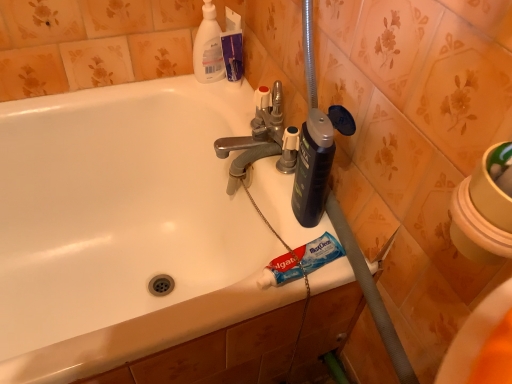
In order to face white glossy bathtub at center, should I rotate leftwards or rightwards?

To face it directly, rotate left by 16.493 degrees.

What do you see at coordinates (124, 226) in the screenshot?
I see `white glossy bathtub at center` at bounding box center [124, 226].

At what (x,y) coordinates should I click in order to perform the action: click on polished chrome faucet at center. Please return your answer as a coordinate pair (x, y). Looking at the image, I should click on (261, 138).

From the image's perspective, is blue matte toothpaste at lower center positioned above or below white plastic bottle at upper center?

blue matte toothpaste at lower center is situated lower than white plastic bottle at upper center in the image.

At what (x,y) coordinates should I click in order to perform the action: click on cleaning product located behind the blue matte toothpaste at lower center. Please return your answer as a coordinate pair (x, y). This screenshot has height=384, width=512. Looking at the image, I should click on (208, 47).

From a real-world perspective, who is located higher, blue matte toothpaste at lower center or white plastic bottle at upper center?

white plastic bottle at upper center.

Is blue matte toothpaste at lower center in front of white plastic bottle at upper center?

Yes, it is.

From the image's perspective, who appears lower, white glossy bathtub at center or white plastic bottle at upper center?

From the image's view, white glossy bathtub at center is below.

How many degrees apart are the facing directions of white glossy bathtub at center and white plastic bottle at upper center?

0.983 degrees separate the facing orientations of white glossy bathtub at center and white plastic bottle at upper center.

Is white glossy bathtub at center bigger than white plastic bottle at upper center?

Correct, white glossy bathtub at center is larger in size than white plastic bottle at upper center.

Considering the relative sizes of white glossy bathtub at center and white plastic bottle at upper center in the image provided, is white glossy bathtub at center wider than white plastic bottle at upper center?

Indeed, white glossy bathtub at center has a greater width compared to white plastic bottle at upper center.

Are white plastic bottle at upper center and blue matte toothpaste at lower center far apart?

white plastic bottle at upper center is actually quite close to blue matte toothpaste at lower center.

Measure the distance between white plastic bottle at upper center and blue matte toothpaste at lower center.

21.56 inches.

Who is bigger, white plastic bottle at upper center or blue matte toothpaste at lower center?

white plastic bottle at upper center.

Does white plastic bottle at upper center come in front of blue matte toothpaste at lower center?

No.

Is blue matte toothpaste at lower center far from white glossy bathtub at center?

They are positioned close to each other.

Where is `toothpaste lying on the right of white glossy bathtub at center`? The height and width of the screenshot is (384, 512). toothpaste lying on the right of white glossy bathtub at center is located at coordinates (301, 261).

Does blue matte toothpaste at lower center lie in front of white glossy bathtub at center?

No, blue matte toothpaste at lower center is further to the viewer.

Is white glossy bathtub at center inside blue matte toothpaste at lower center?

No, blue matte toothpaste at lower center does not contain white glossy bathtub at center.

Based on the photo, which point is more forward, (293, 270) or (260, 117)?

The point (293, 270) is closer.

I want to click on tap above the blue matte toothpaste at lower center (from a real-world perspective), so click(x=261, y=138).

Is blue matte toothpaste at lower center positioned beyond the bounds of polished chrome faucet at center?

Indeed, blue matte toothpaste at lower center is completely outside polished chrome faucet at center.

Based on the photo, from a real-world perspective, is white glossy bathtub at center physically located above or below polished chrome faucet at center?

Clearly, from a real-world perspective, white glossy bathtub at center is below polished chrome faucet at center.

Is white glossy bathtub at center positioned in front of polished chrome faucet at center?

Yes, white glossy bathtub at center is in front of polished chrome faucet at center.

How far apart are white glossy bathtub at center and polished chrome faucet at center?

white glossy bathtub at center and polished chrome faucet at center are 10.70 inches apart.

Looking at the image, does white glossy bathtub at center seem bigger or smaller compared to polished chrome faucet at center?

Considering their sizes, white glossy bathtub at center takes up more space than polished chrome faucet at center.

Which is in front, point (284, 159) or point (8, 114)?

Point (284, 159)

From the image's perspective, does polished chrome faucet at center appear higher than white glossy bathtub at center?

Indeed, from the image's perspective, polished chrome faucet at center is shown above white glossy bathtub at center.

From a real-world perspective, which object rests below the other?

From a 3D spatial view, white glossy bathtub at center is below.

Identify the location of cleaning product on the left of blue matte toothpaste at lower center. 208,47.

Find the location of a particular element. The width and height of the screenshot is (512, 384). cleaning product that appears behind the white glossy bathtub at center is located at coordinates (208, 47).

From the image, which object appears to be farther from white plastic bottle at upper center, polished chrome faucet at center or white glossy bathtub at center?

The object further to white plastic bottle at upper center is white glossy bathtub at center.

Looking at the image, which one is located closer to blue matte toothpaste at lower center, white glossy bathtub at center or white plastic bottle at upper center?

white glossy bathtub at center is closer to blue matte toothpaste at lower center.

Considering their positions, is blue matte toothpaste at lower center positioned closer to white glossy bathtub at center than polished chrome faucet at center?

Among the two, polished chrome faucet at center is located nearer to white glossy bathtub at center.

From the image, which object appears to be farther from blue matte toothpaste at lower center, white glossy bathtub at center or polished chrome faucet at center?

white glossy bathtub at center.

From the image, which object appears to be farther from white glossy bathtub at center, white plastic bottle at upper center or blue matte toothpaste at lower center?

blue matte toothpaste at lower center is further to white glossy bathtub at center.

Considering their positions, is polished chrome faucet at center positioned further to white glossy bathtub at center than white plastic bottle at upper center?

Based on the image, white plastic bottle at upper center appears to be further to white glossy bathtub at center.

Consider the image. Which object lies further to the anchor point polished chrome faucet at center, blue matte toothpaste at lower center or white plastic bottle at upper center?

Based on the image, blue matte toothpaste at lower center appears to be further to polished chrome faucet at center.

Which object lies further to the anchor point polished chrome faucet at center, white glossy bathtub at center or blue matte toothpaste at lower center?

The object further to polished chrome faucet at center is white glossy bathtub at center.

In order to click on tap between white glossy bathtub at center and blue matte toothpaste at lower center in the horizontal direction in this screenshot , I will do [261, 138].

Locate an element on the screen. This screenshot has height=384, width=512. tap between white plastic bottle at upper center and white glossy bathtub at center from top to bottom is located at coordinates (261, 138).

Find the location of a particular element. tap between white plastic bottle at upper center and blue matte toothpaste at lower center from top to bottom is located at coordinates (261, 138).

At what (x,y) coordinates should I click in order to perform the action: click on toothpaste between white plastic bottle at upper center and white glossy bathtub at center in the vertical direction. Please return your answer as a coordinate pair (x, y). Looking at the image, I should click on (301, 261).